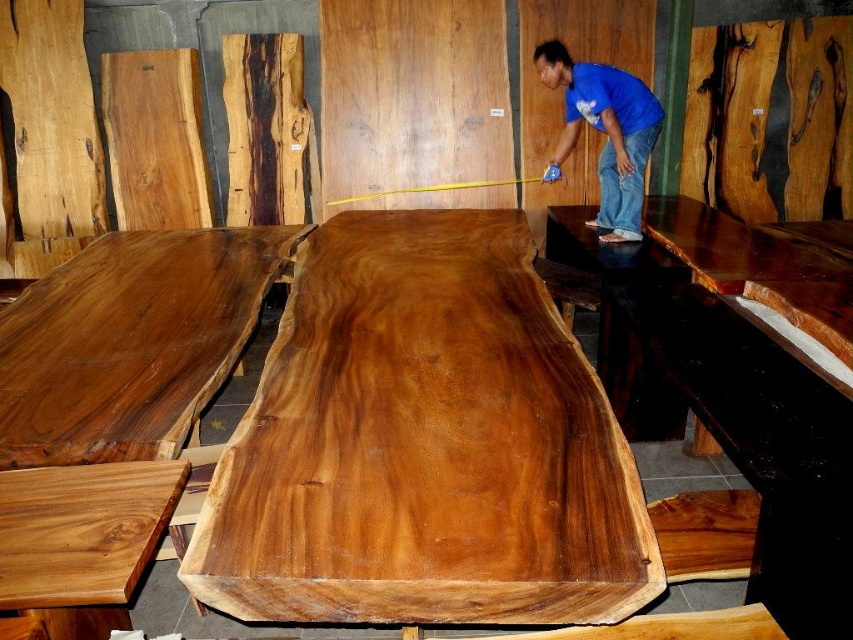
You are organizing a furniture exhibition and need to place a new item between the satin wood table at center and the blue cotton shirt at upper center. Based on their positions, which object should the new item be closer to?

The new item should be closer to the blue cotton shirt at upper center because the satin wood table at center is in front of the blue cotton shirt at upper center, meaning the shirt is further back.

You are an interior designer planning to place a blue cotton shirt at upper center on the satin wood table at center. Will the shirt fit entirely on the table without hanging off the edges?

The satin wood table at center is wider than the blue cotton shirt at upper center, so the shirt will fit entirely on the table without any part hanging off the edges.